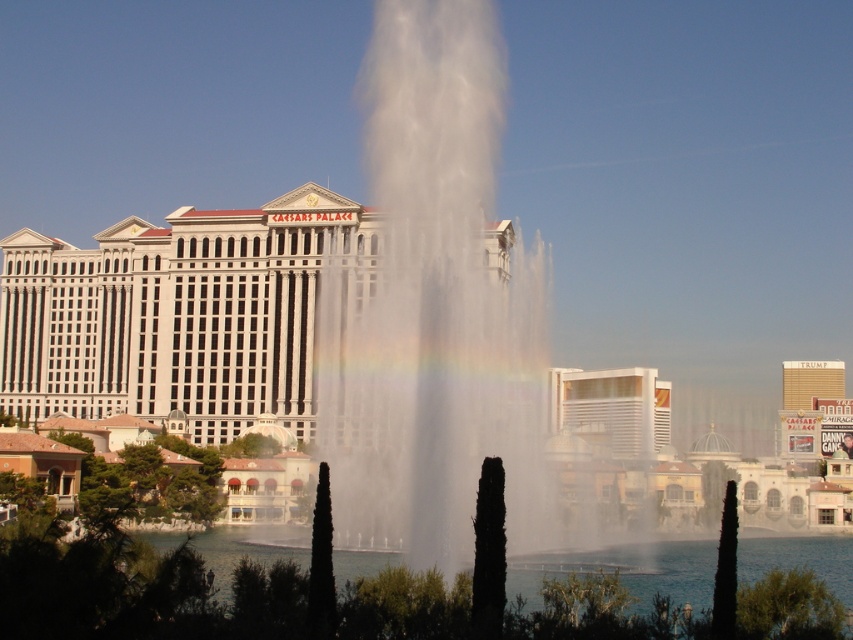
Does clear water at center lie in front of white glossy hotel at center?

That is True.

Find the location of a particular element. clear water at center is located at coordinates (614, 604).

Which is in front, point (563, 564) or point (601, 374)?

Point (563, 564) is in front.

You are a GUI agent. You are given a task and a screenshot of the screen. Output one action in this format:
    pyautogui.click(x=<x>, y=<y>)
    Task: Click on the clear water at center
    The image size is (853, 640).
    Given the screenshot: What is the action you would take?
    pyautogui.click(x=614, y=604)

Does white marble building at center have a smaller size compared to white glossy hotel at center?

Actually, white marble building at center might be larger than white glossy hotel at center.

Can you confirm if white marble building at center is positioned above white glossy hotel at center?

Correct, white marble building at center is located above white glossy hotel at center.

Which is behind, point (344, 236) or point (622, 445)?

Positioned behind is point (622, 445).

In order to click on white marble building at center in this screenshot , I will do `click(178, 316)`.

Between point (476, 84) and point (670, 604), which one is positioned behind?

Point (476, 84)

The width and height of the screenshot is (853, 640). Identify the location of white frothy water at center. pos(434,308).

Who is more distant from viewer, (445, 154) or (218, 636)?

Positioned behind is point (445, 154).

The height and width of the screenshot is (640, 853). In order to click on white frothy water at center in this screenshot , I will do `click(434, 308)`.